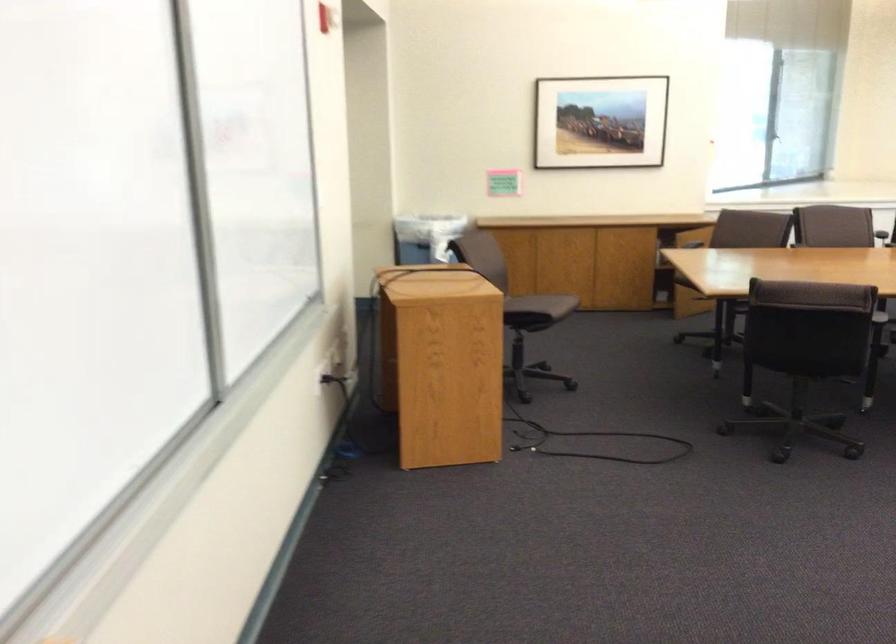
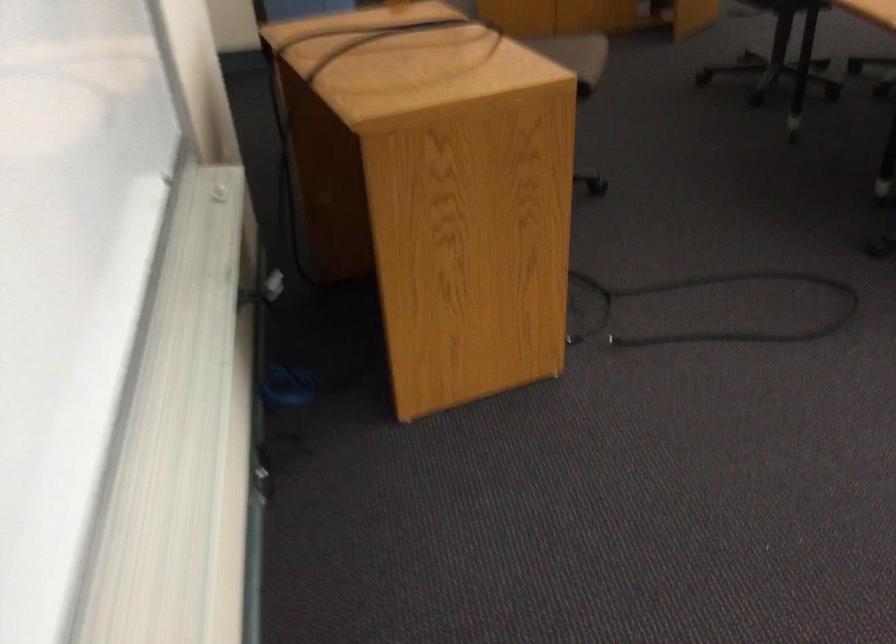
The point at [607,440] is marked in the first image. Where is the corresponding point in the second image?

(712, 308)